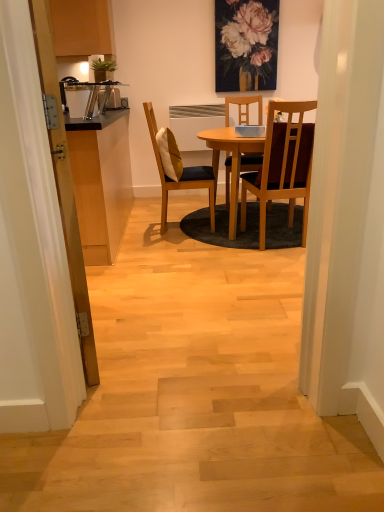
Question: From a real-world perspective, is soft yellow cushion at center located higher than wooden cabinet at left?

Choices:
 (A) no
 (B) yes

Answer: (B)

Question: Does soft yellow cushion at center have a smaller size compared to wooden cabinet at left?

Choices:
 (A) no
 (B) yes

Answer: (B)

Question: Is soft yellow cushion at center not within wooden cabinet at left?

Choices:
 (A) yes
 (B) no

Answer: (A)

Question: Can you confirm if soft yellow cushion at center is positioned to the left of wooden cabinet at left?

Choices:
 (A) yes
 (B) no

Answer: (B)

Question: Is soft yellow cushion at center next to wooden cabinet at left?

Choices:
 (A) yes
 (B) no

Answer: (B)

Question: Does point (299, 118) appear closer or farther from the camera than point (87, 201)?

Choices:
 (A) farther
 (B) closer

Answer: (A)

Question: Visually, is wooden chair at center, marked as the 2th chair in a left-to-right arrangement, positioned to the left or to the right of wooden cabinet at left?

Choices:
 (A) left
 (B) right

Answer: (B)

Question: In the image, is wooden chair at center, marked as the 2th chair in a left-to-right arrangement, positioned in front of or behind wooden cabinet at left?

Choices:
 (A) front
 (B) behind

Answer: (B)

Question: Considering the positions of wooden chair at center, marked as the 2th chair in a left-to-right arrangement, and wooden cabinet at left in the image, is wooden chair at center, marked as the 2th chair in a left-to-right arrangement, wider or thinner than wooden cabinet at left?

Choices:
 (A) thin
 (B) wide

Answer: (A)

Question: Visually, is soft yellow cushion at center positioned to the left or to the right of matte floral painting at upper center?

Choices:
 (A) left
 (B) right

Answer: (A)

Question: Relative to matte floral painting at upper center, is soft yellow cushion at center in front or behind?

Choices:
 (A) behind
 (B) front

Answer: (B)

Question: From the image's perspective, is soft yellow cushion at center positioned above or below matte floral painting at upper center?

Choices:
 (A) below
 (B) above

Answer: (A)

Question: Considering the positions of point (158, 136) and point (256, 7), is point (158, 136) closer or farther from the camera than point (256, 7)?

Choices:
 (A) farther
 (B) closer

Answer: (B)

Question: From the image's perspective, is wooden cabinet at left positioned above or below matte yellow cushioned chair at center, which is the 1th chair from left to right?

Choices:
 (A) below
 (B) above

Answer: (A)

Question: In the image, is wooden cabinet at left on the left side or the right side of matte yellow cushioned chair at center, which is the second chair in right-to-left order?

Choices:
 (A) right
 (B) left

Answer: (B)